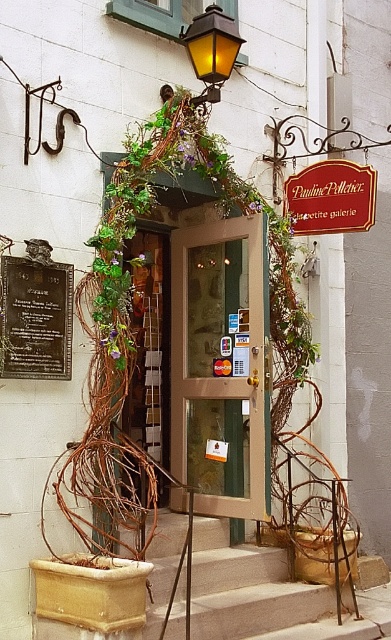
You are a customer approaching the entrance of Pauline Pelletier shop. You need to read both the bronze plaque at center left and the wooden sign at center. Which object should you look at first if you want to read them in the order they are placed from left to right?

The bronze plaque at center left is positioned on the left side of wooden sign at center, so you should look at the bronze plaque at center left first.

You are a delivery person approaching the entrance of Pauline Pelletier shop. You need to reach the matte yellow glass lamp at upper center to hang a package. Can you directly access it from your current position without moving around the smooth concrete stairs at center?

The smooth concrete stairs at center are in front of the matte yellow glass lamp at upper center, so you cannot directly access the matte yellow glass lamp at upper center without moving around the smooth concrete stairs at center.

You are a customer approaching the entrance of Pauline Pelletier shop. You notice the bronze plaque at center left and the matte yellow glass lamp at upper center. Which object is closer to you as you stand in front of the shop?

The bronze plaque at center left is closer to you because it is in front of the matte yellow glass lamp at upper center.